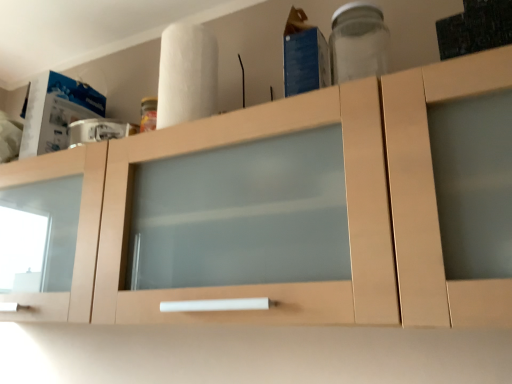
Question: Does point (113, 268) appear closer or farther from the camera than point (344, 4)?

Choices:
 (A) closer
 (B) farther

Answer: (A)

Question: Looking at their shapes, would you say light wood cabinet at center is wider or thinner than transparent glass jar at upper right?

Choices:
 (A) thin
 (B) wide

Answer: (B)

Question: Which of these objects is positioned closest to the transparent glass jar at upper right?

Choices:
 (A) white matte paper towel at upper center
 (B) light wood cabinet at center

Answer: (A)

Question: Which object is the closest to the white matte paper towel at upper center?

Choices:
 (A) transparent glass jar at upper right
 (B) light wood cabinet at center

Answer: (B)